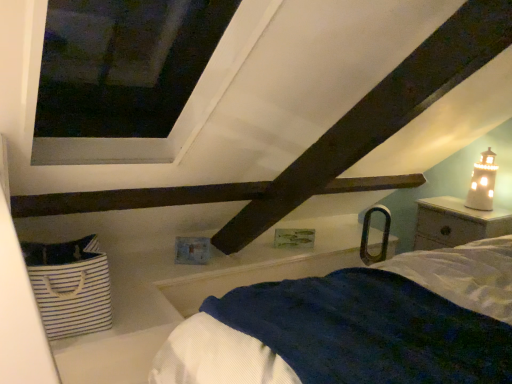
Question: In the image, is white ceramic lighthouse at upper right positioned in front of or behind white striped fabric basket at lower left?

Choices:
 (A) front
 (B) behind

Answer: (B)

Question: In terms of height, does white ceramic lighthouse at upper right look taller or shorter compared to white striped fabric basket at lower left?

Choices:
 (A) short
 (B) tall

Answer: (B)

Question: Which of these objects is positioned closest to the white wood nightstand at right?

Choices:
 (A) white striped fabric basket at lower left
 (B) white ceramic lighthouse at upper right

Answer: (B)

Question: Which object is the farthest from the white striped fabric basket at lower left?

Choices:
 (A) white ceramic lighthouse at upper right
 (B) white wood nightstand at right

Answer: (A)